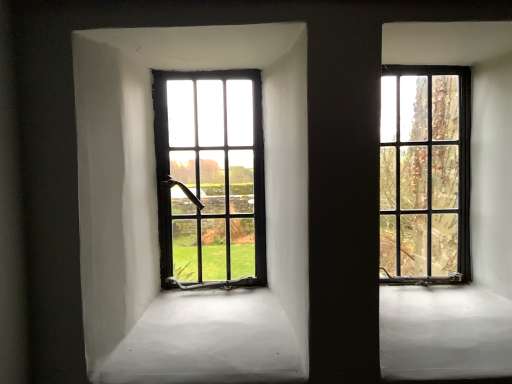
Question: Does matte black window at right, the 1th window positioned from the right, have a lesser height compared to matte black window at center left, which is counted as the second window, starting from the right?

Choices:
 (A) yes
 (B) no

Answer: (B)

Question: Considering the relative sizes of matte black window at right, the 1th window positioned from the right, and matte black window at center left, which is counted as the second window, starting from the right, in the image provided, is matte black window at right, the 1th window positioned from the right, bigger than matte black window at center left, which is counted as the second window, starting from the right,?

Choices:
 (A) yes
 (B) no

Answer: (B)

Question: Is matte black window at right, the 1th window positioned from the right, positioned beyond the bounds of matte black window at center left, which is counted as the second window, starting from the right?

Choices:
 (A) no
 (B) yes

Answer: (B)

Question: Considering the relative sizes of matte black window at right, the 2th window viewed from the left, and matte black window at center left, which is counted as the second window, starting from the right, in the image provided, is matte black window at right, the 2th window viewed from the left, taller than matte black window at center left, which is counted as the second window, starting from the right,?

Choices:
 (A) no
 (B) yes

Answer: (B)

Question: Is matte black window at right, the 2th window viewed from the left, thinner than matte black window at center left, which is counted as the second window, starting from the right?

Choices:
 (A) yes
 (B) no

Answer: (B)

Question: Is matte black window at right, the 2th window viewed from the left, aimed at matte black window at center left, the first window when ordered from left to right?

Choices:
 (A) no
 (B) yes

Answer: (A)

Question: Is the position of matte black window at center left, which is counted as the second window, starting from the right, more distant than that of matte black window at right, the 2th window viewed from the left?

Choices:
 (A) no
 (B) yes

Answer: (B)

Question: From the image's perspective, is matte black window at center left, the first window when ordered from left to right, below matte black window at right, the 2th window viewed from the left?

Choices:
 (A) no
 (B) yes

Answer: (B)

Question: From a real-world perspective, is matte black window at center left, the first window when ordered from left to right, under matte black window at right, the 2th window viewed from the left?

Choices:
 (A) yes
 (B) no

Answer: (A)

Question: Can you confirm if matte black window at center left, which is counted as the second window, starting from the right, is bigger than matte black window at right, the 2th window viewed from the left?

Choices:
 (A) yes
 (B) no

Answer: (A)

Question: Considering the relative sizes of matte black window at center left, the first window when ordered from left to right, and matte black window at right, the 2th window viewed from the left, in the image provided, is matte black window at center left, the first window when ordered from left to right, shorter than matte black window at right, the 2th window viewed from the left,?

Choices:
 (A) yes
 (B) no

Answer: (A)

Question: Considering the relative positions of matte black window at center left, which is counted as the second window, starting from the right, and matte black window at right, the 1th window positioned from the right, in the image provided, is matte black window at center left, which is counted as the second window, starting from the right, to the right of matte black window at right, the 1th window positioned from the right, from the viewer's perspective?

Choices:
 (A) no
 (B) yes

Answer: (A)

Question: From a real-world perspective, relative to matte black window at center left, the first window when ordered from left to right, is matte black window at right, the 1th window positioned from the right, vertically above or below?

Choices:
 (A) above
 (B) below

Answer: (A)